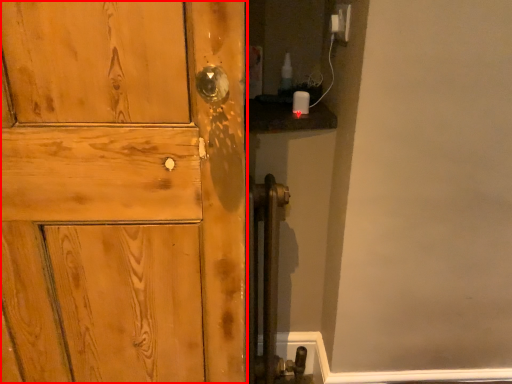
Question: Where is door (annotated by the red box) located in relation to electric outlet in the image?

Choices:
 (A) right
 (B) left

Answer: (B)